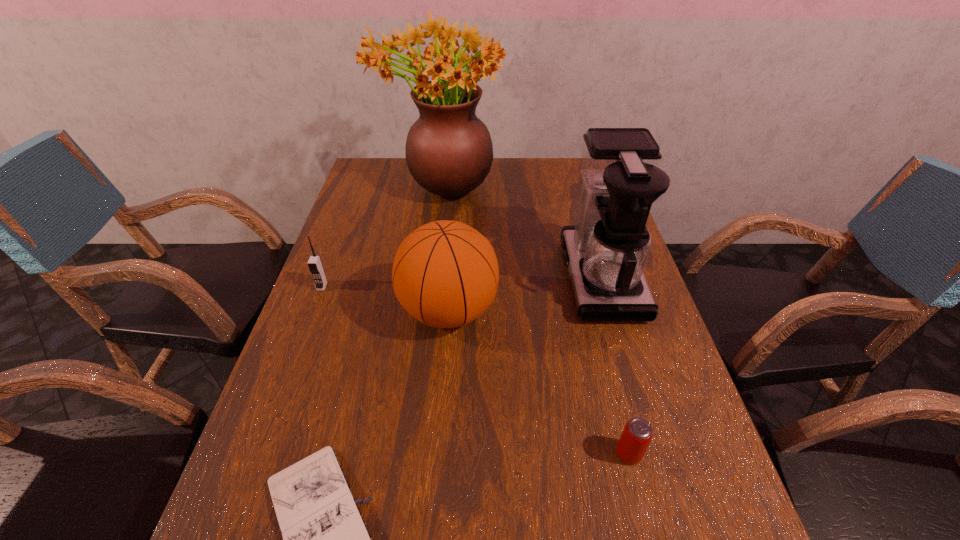
Identify the location of free space at the far edge of the desktop. This screenshot has width=960, height=540. (546, 161).

This screenshot has width=960, height=540. In order to click on vacant space at the left edge in this screenshot , I will do `click(383, 196)`.

The height and width of the screenshot is (540, 960). In the image, there is a desktop. What are the coordinates of `vacant space at the right edge` in the screenshot? It's located at (658, 322).

Locate an element on the screen. The image size is (960, 540). free spot at the far left corner of the desktop is located at coordinates (405, 165).

The width and height of the screenshot is (960, 540). Identify the location of vacant space at the far right corner. (582, 187).

You are a GUI agent. You are given a task and a screenshot of the screen. Output one action in this format:
    pyautogui.click(x=<x>, y=<y>)
    Task: Click on the vacant region between the flower arrangement and the second shortest object
    Image resolution: width=960 pixels, height=540 pixels.
    Given the screenshot: What is the action you would take?
    pyautogui.click(x=535, y=320)

Identify which object is located as the second nearest to the second tallest object. Please provide its 2D coordinates. Your answer should be formatted as a tuple, i.e. [(x, y)], where the tuple contains the x and y coordinates of a point satisfying the conditions above.

[(449, 152)]

I want to click on the second closest object to the basketball, so click(315, 265).

Find the location of a particular element. vacant point that satisfies the following two spatial constraints: 1. at the front of the fifth shortest object where the controls are located; 2. on the front side of the third tallest object is located at coordinates (611, 311).

In order to click on free location that satisfies the following two spatial constraints: 1. at the front of the second tallest object where the controls are located; 2. on the front-facing side of the third shortest object in this screenshot , I will do `click(603, 286)`.